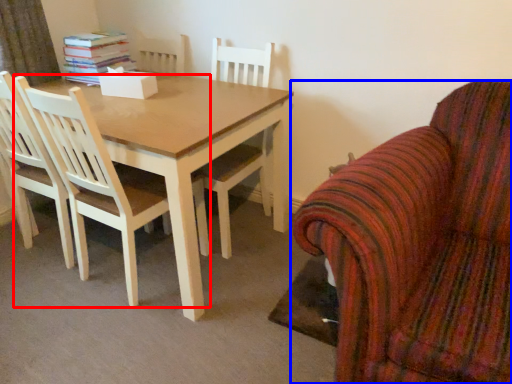
Question: Which object is further to the camera taking this photo, chair (highlighted by a red box) or chair (highlighted by a blue box)?

Choices:
 (A) chair
 (B) chair

Answer: (A)